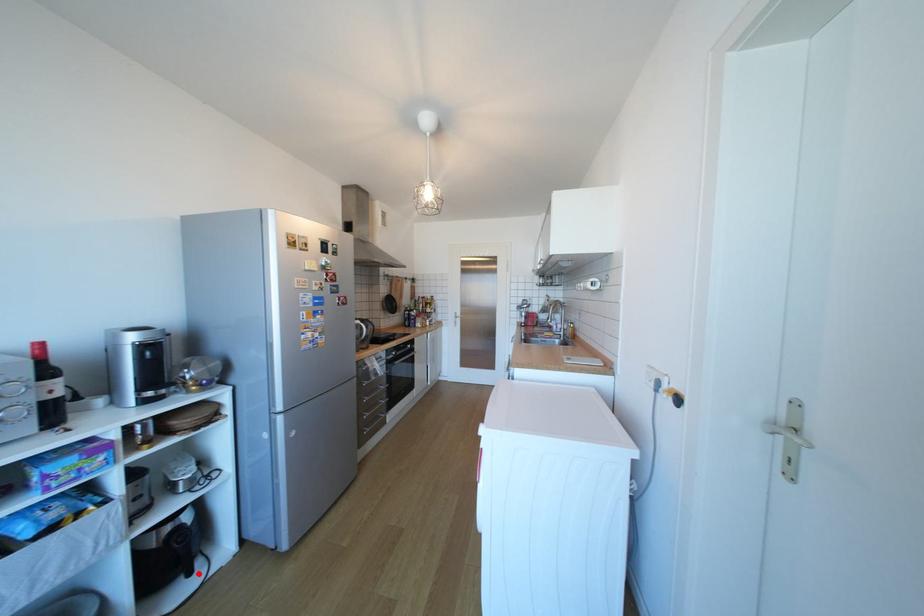
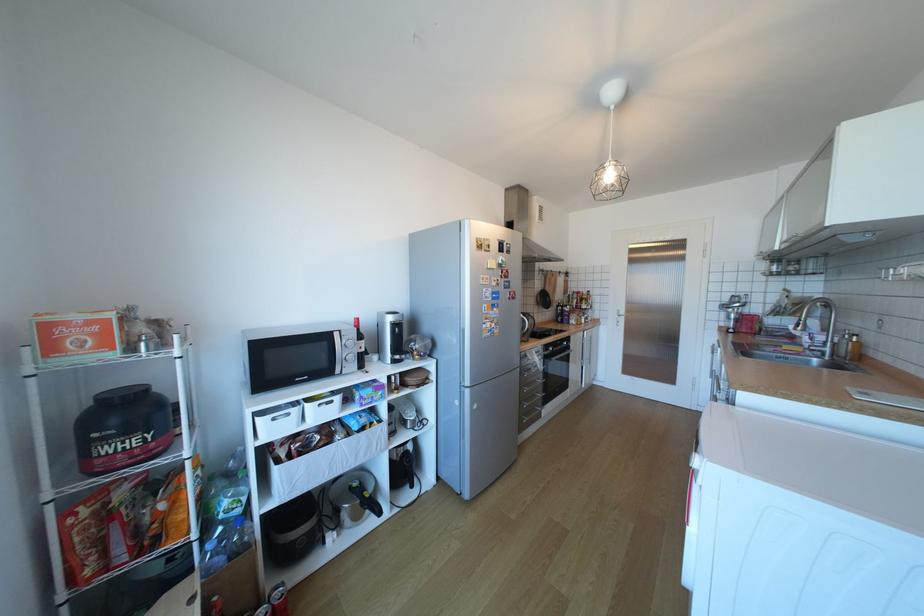
Locate, in the second image, the point that corresponds to the highlighted location in the first image.

(420, 485)